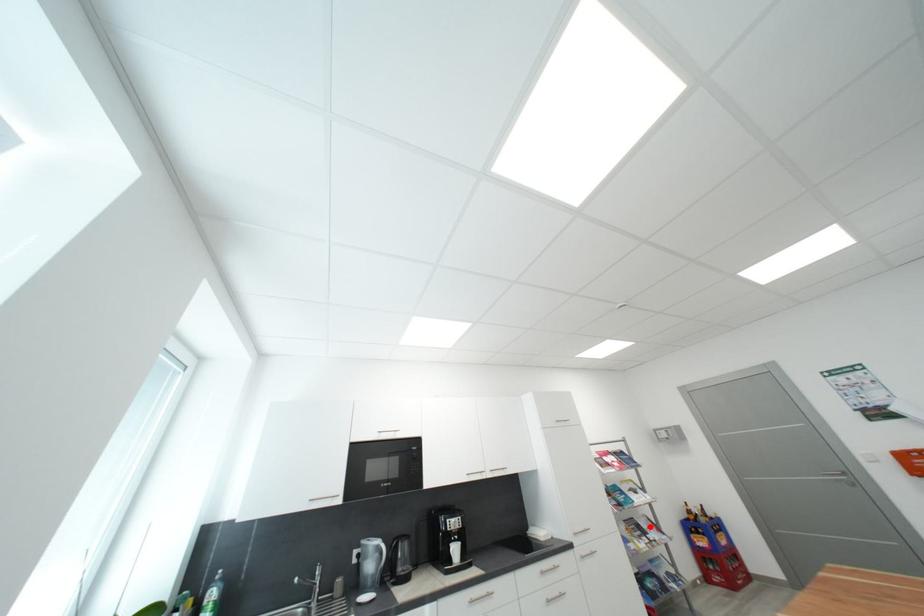
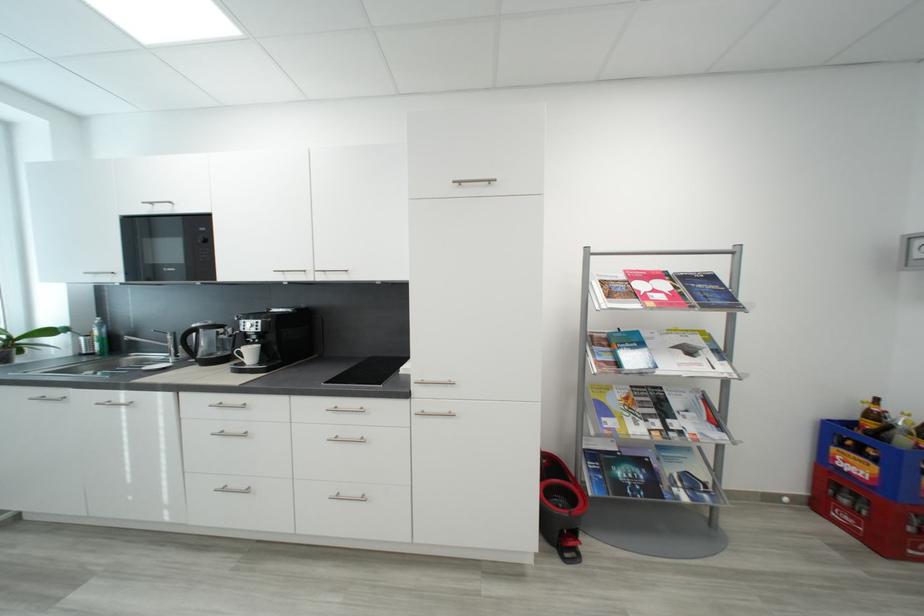
Find the pixel in the second image that matches the highlighted location in the first image.

(684, 406)